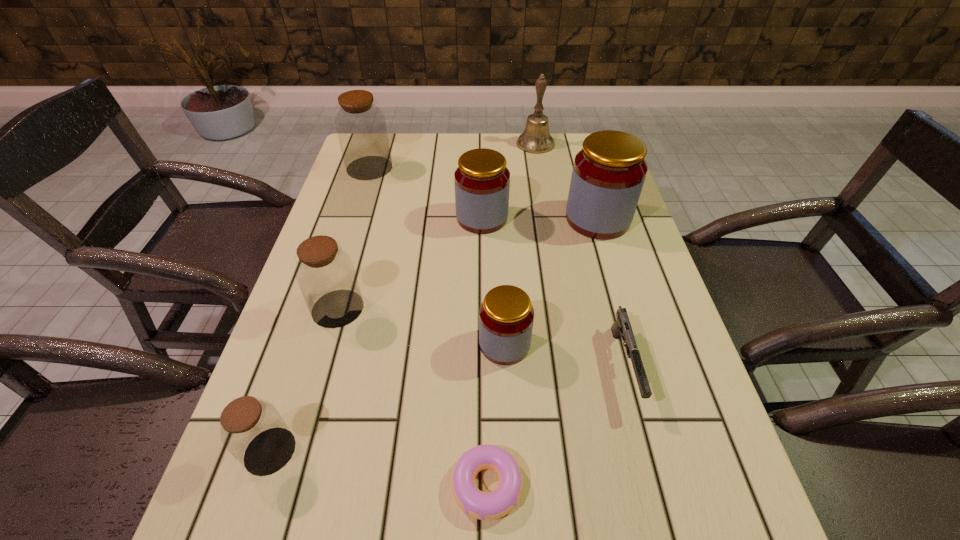
Where is `jar identified as the third closest to the bell`? jar identified as the third closest to the bell is located at coordinates (361, 128).

You are a GUI agent. You are given a task and a screenshot of the screen. Output one action in this format:
    pyautogui.click(x=<x>, y=<y>)
    Task: Click on the jar that stands as the third closest to the second nearest brown jar
    This screenshot has width=960, height=540.
    Given the screenshot: What is the action you would take?
    pyautogui.click(x=482, y=181)

The width and height of the screenshot is (960, 540). Find the location of `the second closest brown jar relative to the doughnut`. the second closest brown jar relative to the doughnut is located at coordinates (325, 274).

Identify which brown jar is the closest to the second biggest red jar. Please provide its 2D coordinates. Your answer should be formatted as a tuple, i.e. [(x, y)], where the tuple contains the x and y coordinates of a point satisfying the conditions above.

[(361, 128)]

Locate an element on the screen. The image size is (960, 540). the closest red jar to the nearest red jar is located at coordinates (482, 181).

Identify which red jar is the closest to the second biggest red jar. Please provide its 2D coordinates. Your answer should be formatted as a tuple, i.e. [(x, y)], where the tuple contains the x and y coordinates of a point satisfying the conditions above.

[(608, 175)]

What are the coordinates of `vacant space that satisfies the following two spatial constraints: 1. on the front side of the smallest red jar; 2. on the left side of the farthest jar` in the screenshot? It's located at tap(314, 344).

The height and width of the screenshot is (540, 960). Find the location of `free spot that satisfies the following two spatial constraints: 1. on the back side of the nearest jar; 2. on the right side of the rightmost jar`. free spot that satisfies the following two spatial constraints: 1. on the back side of the nearest jar; 2. on the right side of the rightmost jar is located at coordinates 348,219.